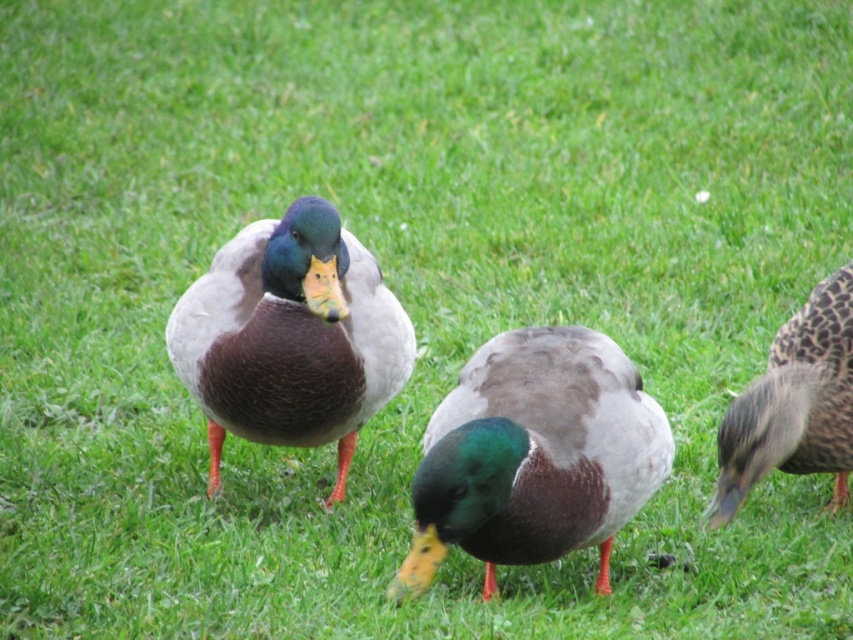
Is green glossy duck at center further to camera compared to shiny brown duck at center?

No, it is in front of shiny brown duck at center.

Image resolution: width=853 pixels, height=640 pixels. What do you see at coordinates (535, 456) in the screenshot? I see `green glossy duck at center` at bounding box center [535, 456].

I want to click on green glossy duck at center, so click(535, 456).

Image resolution: width=853 pixels, height=640 pixels. I want to click on shiny brown duck at center, so click(x=289, y=337).

You are a GUI agent. You are given a task and a screenshot of the screen. Output one action in this format:
    pyautogui.click(x=<x>, y=<y>)
    Task: Click on the shiny brown duck at center
    This screenshot has width=853, height=640.
    Given the screenshot: What is the action you would take?
    pyautogui.click(x=289, y=337)

Who is shorter, green glossy duck at center or brown speckled feathers at right?

green glossy duck at center

Measure the distance between green glossy duck at center and camera.

A distance of 2.61 meters exists between green glossy duck at center and camera.

Which is behind, point (506, 429) or point (724, 484)?

The point (724, 484) is more distant.

This screenshot has width=853, height=640. I want to click on green glossy duck at center, so click(x=535, y=456).